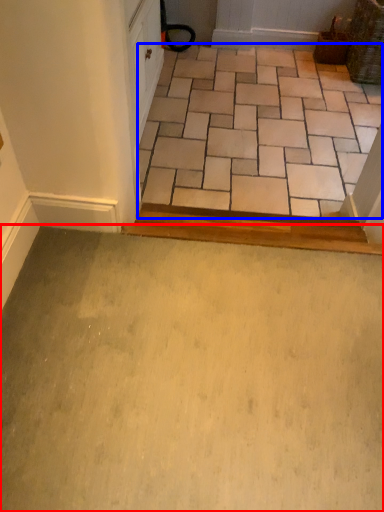
Question: Which object appears farthest to the camera in this image, path (highlighted by a red box) or ceramic tile (highlighted by a blue box)?

Choices:
 (A) path
 (B) ceramic tile

Answer: (B)